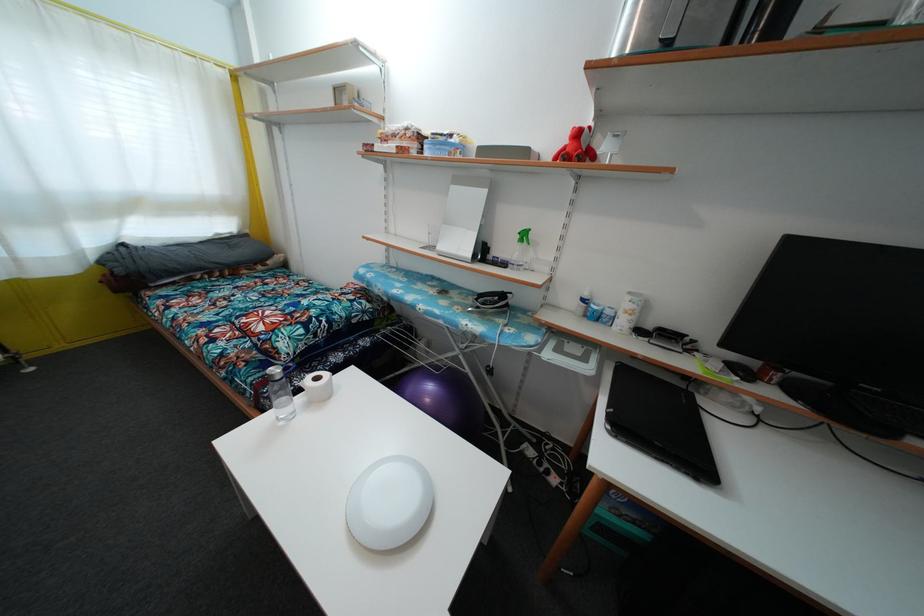
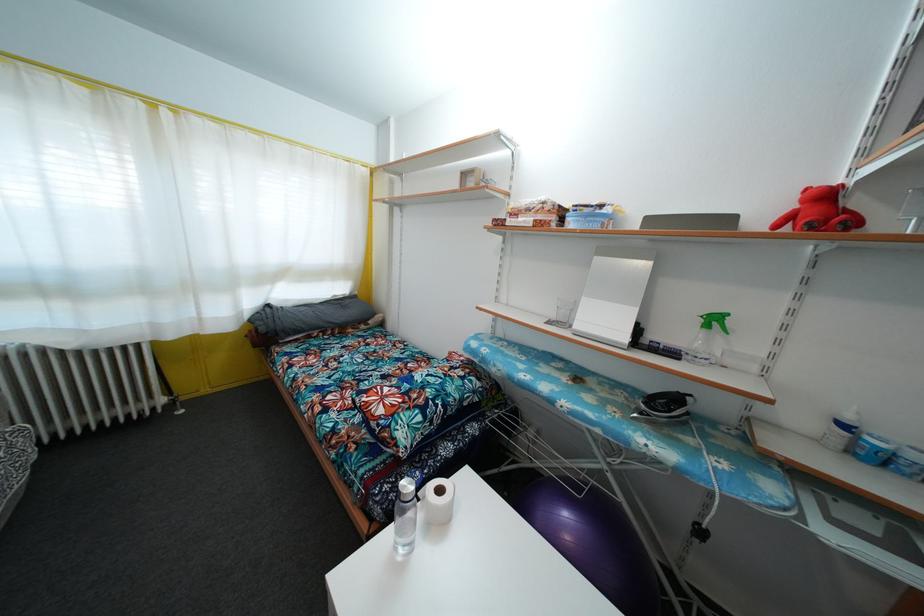
Question: Based on the continuous images, in which direction is the camera rotating? Reply with the corresponding letter.

Choices:
 (A) Left
 (B) Right
 (C) Up
 (D) Down

Answer: (A)